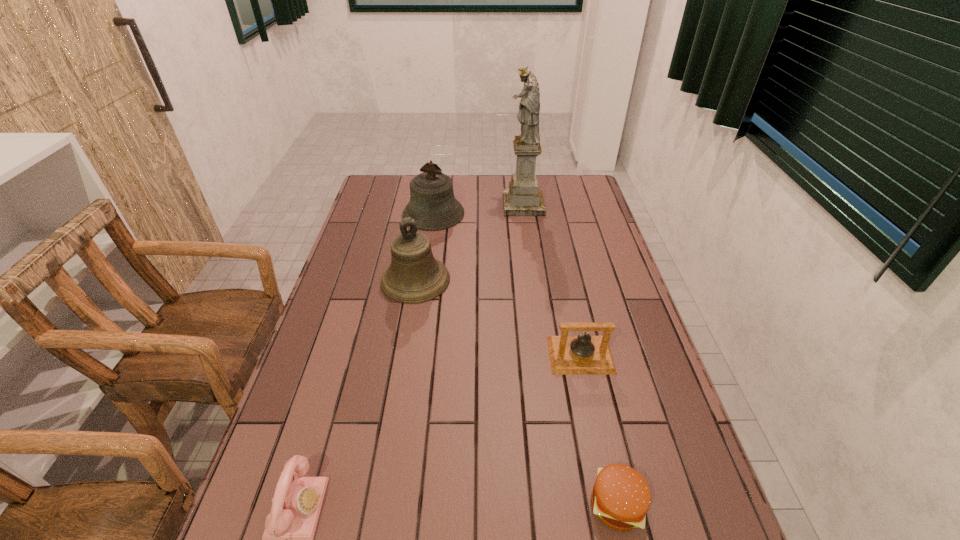
Locate an element on the screen. The width and height of the screenshot is (960, 540). free region at the right edge is located at coordinates (587, 272).

The image size is (960, 540). Identify the location of blank area at the far left corner. (390, 196).

Identify the location of free space at the far right corner of the desktop. (579, 200).

Image resolution: width=960 pixels, height=540 pixels. Find the location of `vacant region between the hamburger and the fourth farthest object`. vacant region between the hamburger and the fourth farthest object is located at coordinates (599, 430).

The height and width of the screenshot is (540, 960). In order to click on free area in between the rightmost bell and the tallest object in this screenshot , I will do `click(552, 280)`.

Where is `unoccupied position between the rightmost bell and the tallest object`? unoccupied position between the rightmost bell and the tallest object is located at coordinates (552, 280).

Image resolution: width=960 pixels, height=540 pixels. Find the location of `empty space between the rightmost bell and the farthest bell`. empty space between the rightmost bell and the farthest bell is located at coordinates (507, 285).

At what (x,y) coordinates should I click in order to perform the action: click on the third closest object to the sculpture. Please return your answer as a coordinate pair (x, y). The width and height of the screenshot is (960, 540). Looking at the image, I should click on (569, 355).

In order to click on the fifth closest object to the telephone in this screenshot , I will do `click(523, 198)`.

I want to click on bell that is the second closest one to the tallest object, so click(414, 276).